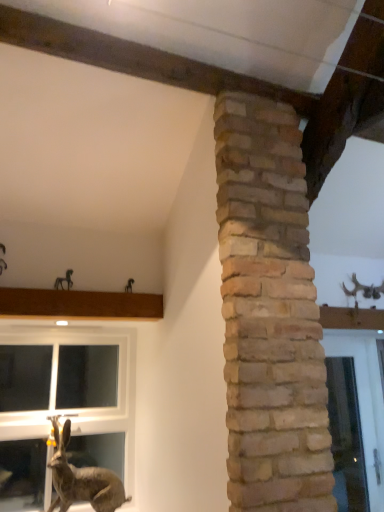
Question: From a real-world perspective, is brown wood at upper left above or below clear glass window at lower left?

Choices:
 (A) below
 (B) above

Answer: (B)

Question: From the image's perspective, is brown wood at upper left above or below clear glass window at lower left?

Choices:
 (A) below
 (B) above

Answer: (B)

Question: Which object is the farthest from the clear glass window at lower left?

Choices:
 (A) brown wood at upper left
 (B) brown textured rabbit at lower left
 (C) metallic horse at upper left

Answer: (C)

Question: Which object is positioned closest to the brown textured rabbit at lower left?

Choices:
 (A) brown wood at upper left
 (B) metallic horse at upper left
 (C) clear glass window at lower left

Answer: (C)